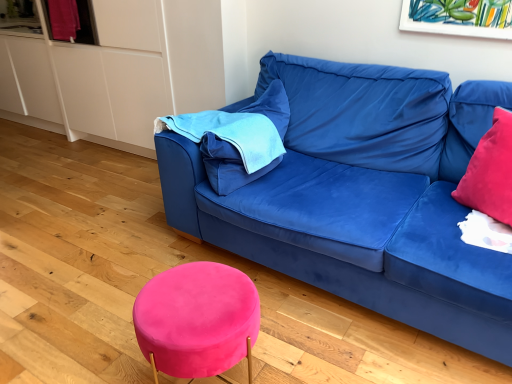
The image size is (512, 384). What do you see at coordinates (362, 196) in the screenshot?
I see `velvet blue couch at center` at bounding box center [362, 196].

What is the approximate width of blue fabric pillow at upper left?

It is 26.22 inches.

The width and height of the screenshot is (512, 384). I want to click on velvet blue couch at center, so click(x=362, y=196).

Would you consider velvet blue couch at center to be distant from blue fabric pillow at upper left?

That's not correct — velvet blue couch at center is a little close to blue fabric pillow at upper left.

From the image's perspective, is velvet blue couch at center under blue fabric pillow at upper left?

Correct, velvet blue couch at center appears lower than blue fabric pillow at upper left in the image.

Is velvet blue couch at center inside or outside of blue fabric pillow at upper left?

velvet blue couch at center is outside blue fabric pillow at upper left.

Is velvet blue couch at center thinner than blue fabric pillow at upper left?

Incorrect, the width of velvet blue couch at center is not less than that of blue fabric pillow at upper left.

Considering the positions of points (458, 309) and (483, 194), is point (458, 309) farther from camera compared to point (483, 194)?

No, it is not.

Locate an element on the screen. throw pillow that is on the right side of velvet blue couch at center is located at coordinates (490, 172).

From a real-world perspective, relative to velvet red pillow at right, is velvet blue couch at center vertically above or below?

velvet blue couch at center is situated lower than velvet red pillow at right in the real world.

From the image's perspective, does velvet blue couch at center appear higher than velvet red pillow at right?

No, from the image's perspective, velvet blue couch at center is not on top of velvet red pillow at right.

How distant is blue fabric pillow at upper left from velvet red pillow at right?

blue fabric pillow at upper left and velvet red pillow at right are 95.91 centimeters apart.

From the image's perspective, between blue fabric pillow at upper left and velvet red pillow at right, which one is located above?

blue fabric pillow at upper left, from the image's perspective.

From the picture: Considering the relative positions of blue fabric pillow at upper left and velvet red pillow at right in the image provided, is blue fabric pillow at upper left to the right of velvet red pillow at right from the viewer's perspective?

Incorrect, blue fabric pillow at upper left is not on the right side of velvet red pillow at right.

Is blue fabric pillow at upper left shorter than velvet red pillow at right?

Indeed, blue fabric pillow at upper left has a lesser height compared to velvet red pillow at right.

Considering the relative sizes of blue fabric pillow at upper left and velvet blue couch at center in the image provided, is blue fabric pillow at upper left shorter than velvet blue couch at center?

Correct, blue fabric pillow at upper left is not as tall as velvet blue couch at center.

Does point (206, 158) appear closer or farther from the camera than point (378, 164)?

Clearly, point (206, 158) is closer to the camera than point (378, 164).

Considering the relative positions of blue fabric pillow at upper left and velvet blue couch at center in the image provided, is blue fabric pillow at upper left to the right of velvet blue couch at center from the viewer's perspective?

No.

Identify the location of pillow above the velvet blue couch at center (from a real-world perspective). (228, 165).

Which is in front, point (490, 167) or point (234, 291)?

Positioned in front is point (234, 291).

Considering the sizes of velvet red pillow at right and velvet pink stool at lower center in the image, is velvet red pillow at right wider or thinner than velvet pink stool at lower center?

Considering their sizes, velvet red pillow at right looks slimmer than velvet pink stool at lower center.

In terms of height, does velvet red pillow at right look taller or shorter compared to velvet pink stool at lower center?

velvet red pillow at right is shorter than velvet pink stool at lower center.

Which of these two, velvet red pillow at right or blue fabric pillow at upper left, is bigger?

With larger size is blue fabric pillow at upper left.

Considering the sizes of objects velvet red pillow at right and blue fabric pillow at upper left in the image provided, who is taller, velvet red pillow at right or blue fabric pillow at upper left?

With more height is velvet red pillow at right.

Choose the correct answer: Is velvet red pillow at right inside blue fabric pillow at upper left or outside it?

velvet red pillow at right is located beyond the bounds of blue fabric pillow at upper left.

From the picture: In terms of size, does velvet red pillow at right appear bigger or smaller than velvet blue couch at center?

Clearly, velvet red pillow at right is smaller in size than velvet blue couch at center.

Could you tell me if velvet red pillow at right is turned towards velvet blue couch at center?

Yes, velvet red pillow at right is turned towards velvet blue couch at center.

Is velvet red pillow at right inside the boundaries of velvet blue couch at center, or outside?

velvet red pillow at right exists entirely within velvet blue couch at center.

From the image's perspective, is velvet red pillow at right located beneath velvet blue couch at center?

Actually, velvet red pillow at right appears above velvet blue couch at center in the image.

Where is `studio couch to the right of blue fabric pillow at upper left`? studio couch to the right of blue fabric pillow at upper left is located at coordinates (362, 196).

The height and width of the screenshot is (384, 512). In order to click on throw pillow that is above the velvet blue couch at center (from the image's perspective) in this screenshot , I will do 490,172.

Considering their positions, is velvet red pillow at right positioned further to blue fabric pillow at upper left than velvet pink stool at lower center?

velvet red pillow at right is positioned further to the anchor blue fabric pillow at upper left.

When comparing their distances from blue fabric pillow at upper left, does velvet pink stool at lower center or velvet blue couch at center seem closer?

velvet blue couch at center lies closer to blue fabric pillow at upper left than the other object.

From the image, which object appears to be nearer to velvet red pillow at right, blue fabric pillow at upper left or velvet pink stool at lower center?

Based on the image, blue fabric pillow at upper left appears to be nearer to velvet red pillow at right.

Looking at the image, which one is located further to blue fabric pillow at upper left, velvet pink stool at lower center or velvet red pillow at right?

velvet red pillow at right is positioned further to the anchor blue fabric pillow at upper left.

Based on their spatial positions, is velvet blue couch at center or velvet red pillow at right further from blue fabric pillow at upper left?

The object further to blue fabric pillow at upper left is velvet red pillow at right.

From the image, which object appears to be farther from velvet red pillow at right, velvet blue couch at center or blue fabric pillow at upper left?

blue fabric pillow at upper left is further to velvet red pillow at right.

Estimate the real-world distances between objects in this image. Which object is closer to velvet red pillow at right, velvet pink stool at lower center or velvet blue couch at center?

The object closer to velvet red pillow at right is velvet blue couch at center.

When comparing their distances from velvet blue couch at center, does velvet red pillow at right or blue fabric pillow at upper left seem further?

Based on the image, velvet red pillow at right appears to be further to velvet blue couch at center.

Identify the location of studio couch between blue fabric pillow at upper left and velvet red pillow at right. (362, 196).

Locate an element on the screen. The height and width of the screenshot is (384, 512). studio couch between velvet pink stool at lower center and velvet red pillow at right from left to right is located at coordinates (362, 196).

Locate an element on the screen. The image size is (512, 384). bar stool between blue fabric pillow at upper left and velvet red pillow at right from left to right is located at coordinates (197, 320).

This screenshot has width=512, height=384. What are the coordinates of `bar stool between velvet blue couch at center and blue fabric pillow at upper left from front to back` in the screenshot? It's located at (197, 320).